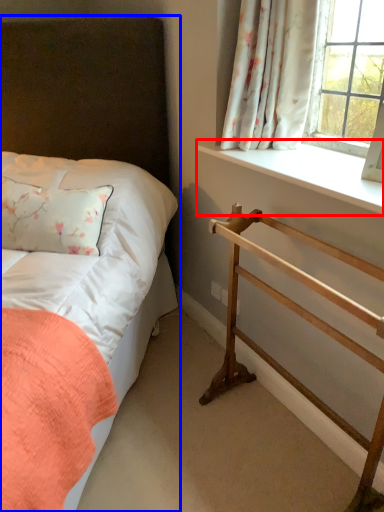
Question: Which object appears farthest to the camera in this image, window sill (highlighted by a red box) or bed (highlighted by a blue box)?

Choices:
 (A) window sill
 (B) bed

Answer: (A)